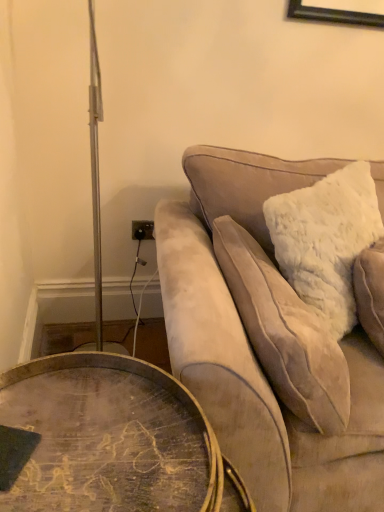
Find the location of a particular element. Image resolution: width=384 pixels, height=512 pixels. white fluffy pillow at right is located at coordinates (284, 333).

How many degrees apart are the facing directions of wooden round table at lower left and velvet beige couch at upper right?

The facing directions of wooden round table at lower left and velvet beige couch at upper right are 0.136 degrees apart.

Is point (123, 433) more distant than point (292, 364)?

No, (123, 433) is closer to viewer.

Visually, is wooden round table at lower left positioned to the left or to the right of velvet beige couch at upper right?

wooden round table at lower left is positioned on velvet beige couch at upper right's left side.

Based on the photo, is wooden round table at lower left turned away from velvet beige couch at upper right?

No.

Can we say velvet beige couch at upper right lies outside white fluffy pillow at right?

Absolutely, velvet beige couch at upper right is external to white fluffy pillow at right.

From a real-world perspective, which is physically above, velvet beige couch at upper right or white fluffy pillow at right?

From a 3D spatial view, white fluffy pillow at right is above.

Which is more to the right, velvet beige couch at upper right or white fluffy pillow at right?

From the viewer's perspective, velvet beige couch at upper right appears more on the right side.

Does point (364, 354) appear closer or farther from the camera than point (331, 400)?

Point (364, 354) appears to be farther away from the viewer than point (331, 400).

Does wooden round table at lower left lie in front of white fluffy pillow at right?

That is True.

From a real-world perspective, which is physically below, wooden round table at lower left or white fluffy pillow at right?

From a 3D spatial view, wooden round table at lower left is below.

What's the angular difference between white fluffy pillow at right and velvet beige couch at upper right's facing directions?

They differ by 88.1 degrees in their facing directions.

Can you confirm if white fluffy pillow at right is positioned to the left of velvet beige couch at upper right?

Yes, white fluffy pillow at right is to the left of velvet beige couch at upper right.

Based on the photo, is the surface of white fluffy pillow at right in direct contact with velvet beige couch at upper right?

Yes, white fluffy pillow at right is in contact with velvet beige couch at upper right.

Does white fluffy pillow at right have a greater width compared to velvet beige couch at upper right?

No, white fluffy pillow at right is not wider than velvet beige couch at upper right.

Which object is positioned more to the right, white fluffy pillow at right or wooden round table at lower left?

white fluffy pillow at right is more to the right.

Considering the relative sizes of white fluffy pillow at right and wooden round table at lower left in the image provided, is white fluffy pillow at right thinner than wooden round table at lower left?

Correct, the width of white fluffy pillow at right is less than that of wooden round table at lower left.

From a real-world perspective, does white fluffy pillow at right sit lower than wooden round table at lower left?

No, from a real-world perspective, white fluffy pillow at right is not below wooden round table at lower left.

From a real-world perspective, is velvet beige couch at upper right above or below wooden round table at lower left?

From a real-world perspective, velvet beige couch at upper right is physically above wooden round table at lower left.

Does point (326, 446) come behind point (58, 507)?

Yes, it is.

In terms of height, does velvet beige couch at upper right look taller or shorter compared to wooden round table at lower left?

In the image, velvet beige couch at upper right appears to be taller than wooden round table at lower left.

Between velvet beige couch at upper right and wooden round table at lower left, which one has smaller width?

wooden round table at lower left.

Locate an element on the screen. This screenshot has height=512, width=384. coffee table below the velvet beige couch at upper right (from the image's perspective) is located at coordinates (108, 440).

The image size is (384, 512). I want to click on pillow on the left of velvet beige couch at upper right, so click(x=284, y=333).

Based on their spatial positions, is wooden round table at lower left or velvet beige couch at upper right closer to white fluffy pillow at right?

The object closer to white fluffy pillow at right is velvet beige couch at upper right.

Looking at the image, which one is located further to velvet beige couch at upper right, white fluffy pillow at right or wooden round table at lower left?

wooden round table at lower left.

Consider the image. Based on their spatial positions, is velvet beige couch at upper right or wooden round table at lower left further from white fluffy pillow at right?

wooden round table at lower left.

From the image, which object appears to be farther from wooden round table at lower left, velvet beige couch at upper right or white fluffy pillow at right?

Among the two, white fluffy pillow at right is located further to wooden round table at lower left.

Which object lies further to the anchor point wooden round table at lower left, white fluffy pillow at right or velvet beige couch at upper right?

white fluffy pillow at right lies further to wooden round table at lower left than the other object.

In the scene shown: From the image, which object appears to be nearer to velvet beige couch at upper right, wooden round table at lower left or white fluffy pillow at right?

The object closer to velvet beige couch at upper right is white fluffy pillow at right.

I want to click on pillow located between wooden round table at lower left and velvet beige couch at upper right in the left-right direction, so click(x=284, y=333).